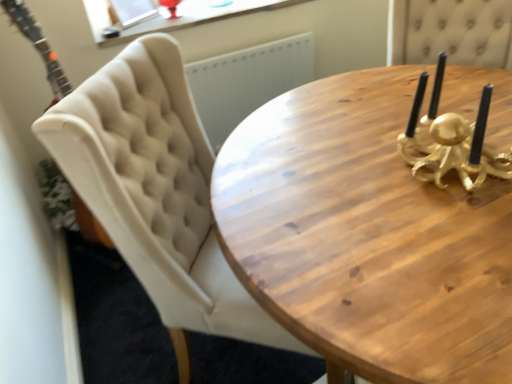
At what (x,y) coordinates should I click in order to perform the action: click on wooden candle holder at upper right. Please return your answer as a coordinate pair (x, y). Looking at the image, I should click on (366, 236).

This screenshot has width=512, height=384. Describe the element at coordinates (366, 236) in the screenshot. I see `wooden candle holder at upper right` at that location.

Measure the distance between point (424,267) and camera.

The depth of point (424,267) is 31.06 inches.

What is the approximate width of beige tufted chair at upper left?

beige tufted chair at upper left is 63.58 centimeters in width.

What do you see at coordinates (156, 192) in the screenshot?
I see `beige tufted chair at upper left` at bounding box center [156, 192].

Find the location of `beige tufted chair at upper left`. beige tufted chair at upper left is located at coordinates (156, 192).

Where is `wooden candle holder at upper right`? The width and height of the screenshot is (512, 384). wooden candle holder at upper right is located at coordinates (366, 236).

Is wooden candle holder at upper right to the left of beige tufted chair at upper left from the viewer's perspective?

No.

Is the position of wooden candle holder at upper right more distant than that of beige tufted chair at upper left?

No, wooden candle holder at upper right is closer to the viewer.

Considering the positions of point (504, 116) and point (156, 102), is point (504, 116) closer or farther from the camera than point (156, 102)?

Point (504, 116) appears to be farther away from the viewer than point (156, 102).

From the image's perspective, relative to beige tufted chair at upper left, is wooden candle holder at upper right above or below?

Clearly, from the image's perspective, wooden candle holder at upper right is below beige tufted chair at upper left.

From a real-world perspective, between wooden candle holder at upper right and beige tufted chair at upper left, who is vertically lower?

From a 3D spatial view, beige tufted chair at upper left is below.

In the scene shown: Is wooden candle holder at upper right wider than beige tufted chair at upper left?

No.

Which of these two, wooden candle holder at upper right or beige tufted chair at upper left, stands taller?

beige tufted chair at upper left.

Which of these two, wooden candle holder at upper right or beige tufted chair at upper left, is bigger?

With larger size is beige tufted chair at upper left.

Is wooden candle holder at upper right outside of beige tufted chair at upper left?

Yes.

Are wooden candle holder at upper right and beige tufted chair at upper left far apart?

wooden candle holder at upper right is near beige tufted chair at upper left, not far away.

Is wooden candle holder at upper right looking in the opposite direction of beige tufted chair at upper left?

No, wooden candle holder at upper right is not facing away from beige tufted chair at upper left.

This screenshot has height=384, width=512. Find the location of `coffee table below the beige tufted chair at upper left (from the image's perspective)`. coffee table below the beige tufted chair at upper left (from the image's perspective) is located at coordinates (366, 236).

Which object is positioned more to the left, beige tufted chair at upper left or wooden candle holder at upper right?

Positioned to the left is beige tufted chair at upper left.

In the scene shown: Which object is more forward, beige tufted chair at upper left or wooden candle holder at upper right?

wooden candle holder at upper right is more forward.

Which is less distant, (65, 150) or (397, 338)?

Point (65, 150) is farther from the camera than point (397, 338).

From the image's perspective, is beige tufted chair at upper left above wooden candle holder at upper right?

Yes, from the image's perspective, beige tufted chair at upper left is over wooden candle holder at upper right.

From a real-world perspective, who is located higher, beige tufted chair at upper left or wooden candle holder at upper right?

In real-world perspective, wooden candle holder at upper right is above.

In terms of width, does beige tufted chair at upper left look wider or thinner when compared to wooden candle holder at upper right?

Considering their sizes, beige tufted chair at upper left looks broader than wooden candle holder at upper right.

From the picture: Can you confirm if beige tufted chair at upper left is shorter than wooden candle holder at upper right?

No, beige tufted chair at upper left is not shorter than wooden candle holder at upper right.

Between beige tufted chair at upper left and wooden candle holder at upper right, which one has smaller size?

With smaller size is wooden candle holder at upper right.

Can we say beige tufted chair at upper left lies outside wooden candle holder at upper right?

beige tufted chair at upper left lies outside wooden candle holder at upper right's area.

Would you consider beige tufted chair at upper left to be distant from wooden candle holder at upper right?

No, beige tufted chair at upper left is in close proximity to wooden candle holder at upper right.

Is beige tufted chair at upper left oriented away from wooden candle holder at upper right?

No, wooden candle holder at upper right is not at the back of beige tufted chair at upper left.

What's the angular difference between beige tufted chair at upper left and wooden candle holder at upper right's facing directions?

The angle between the facing direction of beige tufted chair at upper left and the facing direction of wooden candle holder at upper right is 95.3 degrees.

Measure the distance between beige tufted chair at upper left and wooden candle holder at upper right.

beige tufted chair at upper left is 12.60 inches from wooden candle holder at upper right.

In order to click on coffee table that appears below the beige tufted chair at upper left (from the image's perspective) in this screenshot , I will do `click(366, 236)`.

In the image, there is a wooden candle holder at upper right. Identify the location of chair below it (from a real-world perspective). (156, 192).

Find the location of a particular element. coffee table below the beige tufted chair at upper left (from the image's perspective) is located at coordinates (366, 236).